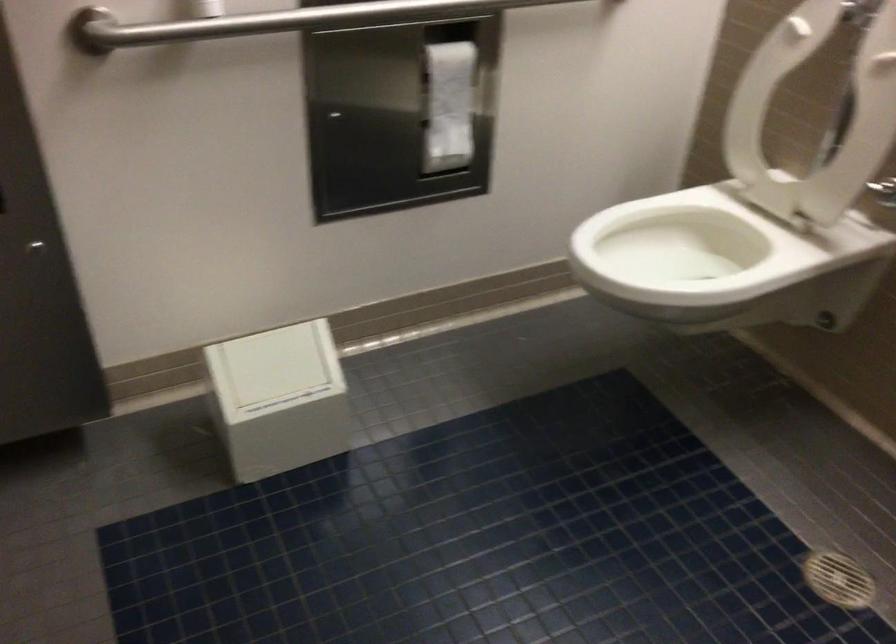
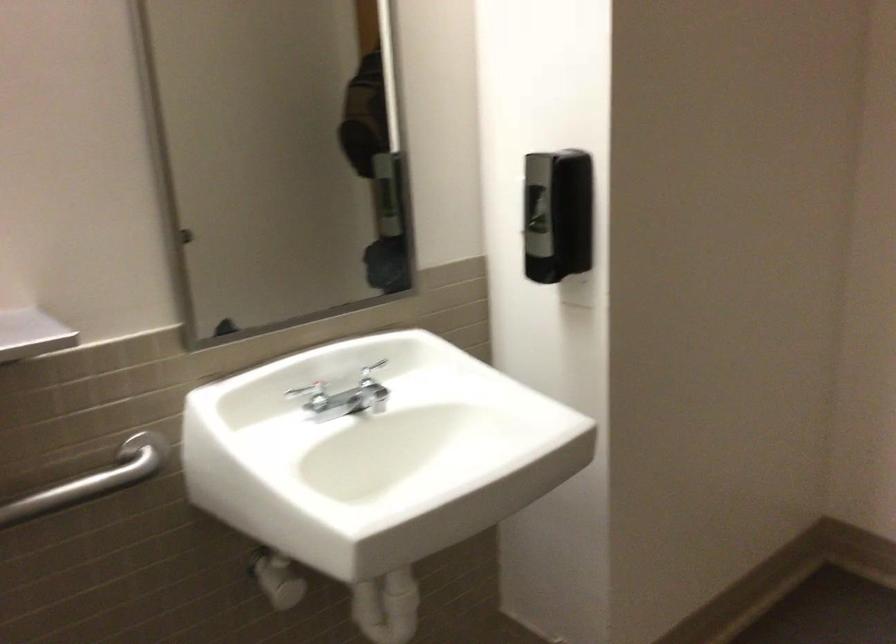
The first image is from the beginning of the video and the second image is from the end. How did the camera likely rotate when shooting the video?

The camera's rotation is toward right-down.